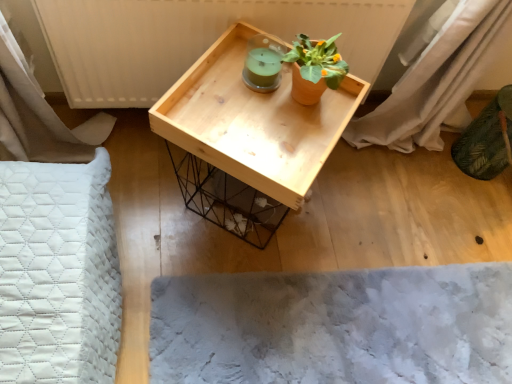
Where is `vacant space to the right of natural wood tray at center`? vacant space to the right of natural wood tray at center is located at coordinates (360, 204).